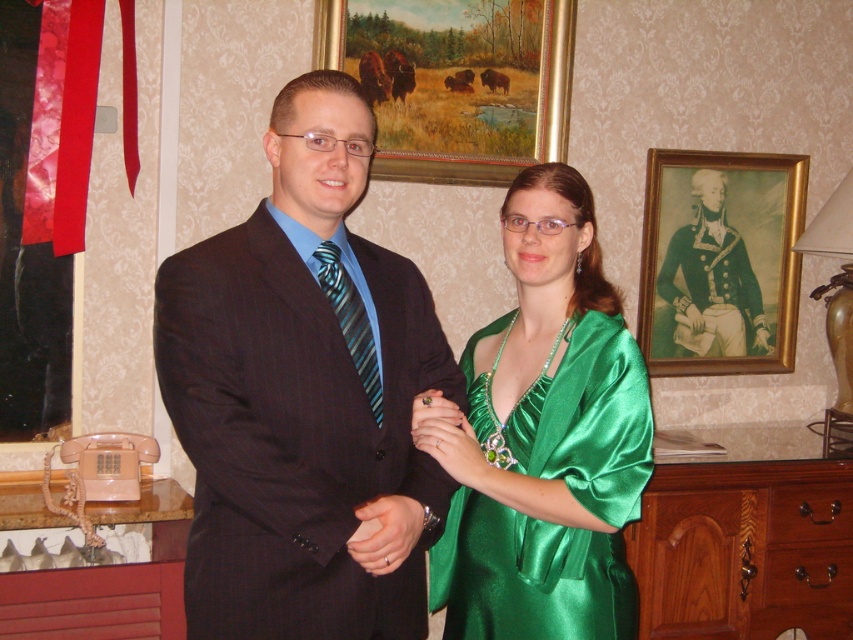
What is the object located at the coordinates point (720,260) in the image?

The point (720,260) marks the location of the gold framed portrait at upper right.